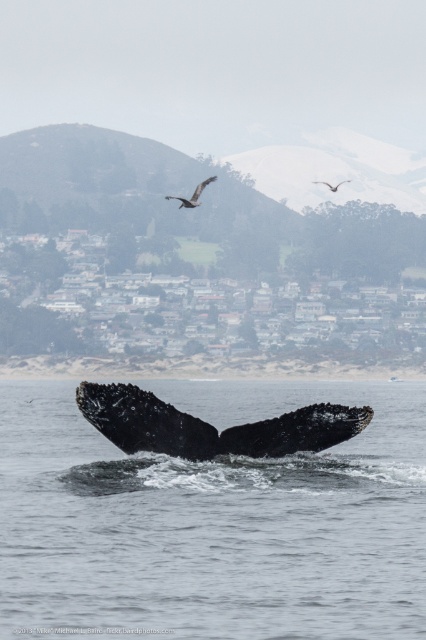
Question: Does black textured whale tail at center have a lesser width compared to dark brown feathered bird at upper center?

Choices:
 (A) yes
 (B) no

Answer: (A)

Question: Is dark brown feathered bird at upper center closer to camera compared to brown feathered eagle at upper center?

Choices:
 (A) no
 (B) yes

Answer: (B)

Question: Which object is the closest to the black matte water at lower center?

Choices:
 (A) brown feathered eagle at upper center
 (B) dark brown feathered bird at upper center

Answer: (B)

Question: Which point appears closest to the camera in this image?

Choices:
 (A) [307, 448]
 (B) [317, 180]
 (C) [213, 176]

Answer: (A)

Question: Among these objects, which one is nearest to the camera?

Choices:
 (A) brown feathered eagle at upper center
 (B) black textured whale tail at center
 (C) black matte water at lower center
 (D) dark brown feathered bird at upper center

Answer: (C)

Question: Can you confirm if black matte water at lower center is thinner than dark brown feathered bird at upper center?

Choices:
 (A) no
 (B) yes

Answer: (A)